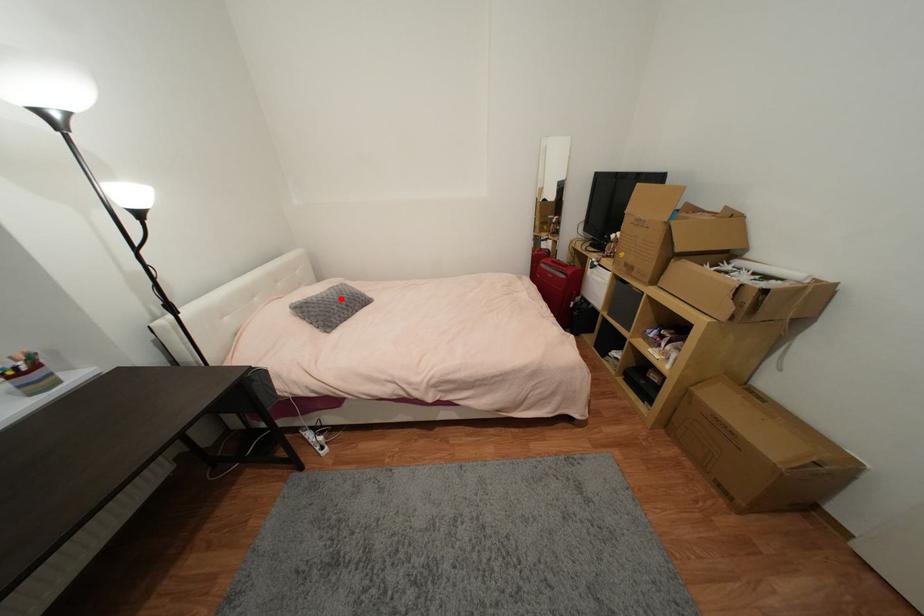
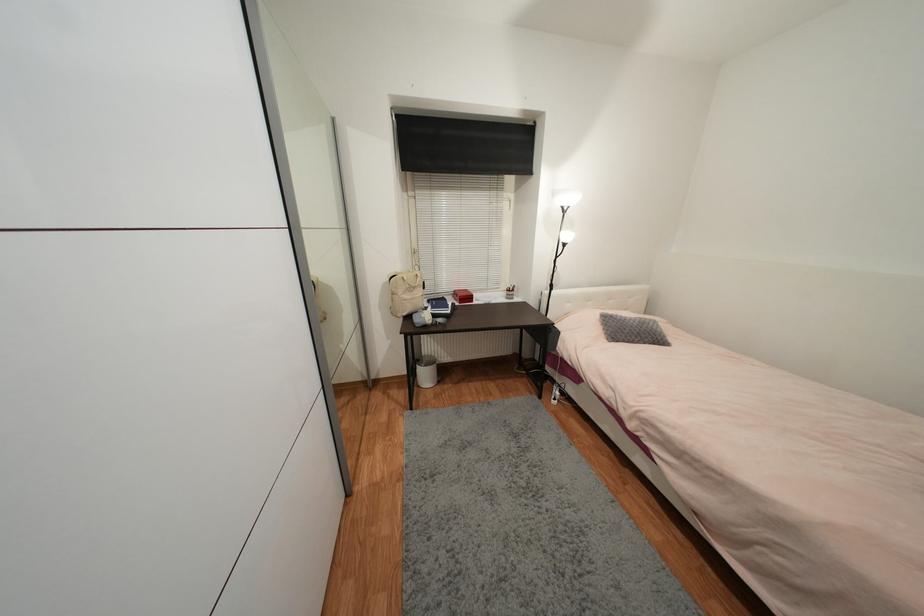
Question: A red point is marked in image1. In image2, is the corresponding 3D point closer to the camera or farther? Reply with the corresponding letter.

Choices:
 (A) The corresponding 3D point is closer.
 (B) The corresponding 3D point is farther.

Answer: (B)